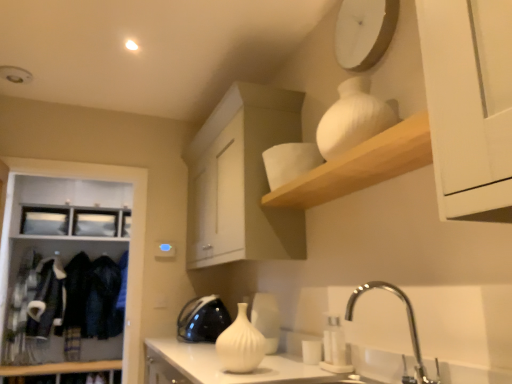
Question: From a real-world perspective, is white glossy vase at center physically below white matte clock at upper center?

Choices:
 (A) no
 (B) yes

Answer: (B)

Question: Can you confirm if white glossy vase at center is shorter than white matte clock at upper center?

Choices:
 (A) no
 (B) yes

Answer: (B)

Question: Could you tell me if white glossy vase at center is facing white matte clock at upper center?

Choices:
 (A) no
 (B) yes

Answer: (A)

Question: Is white glossy vase at center bigger than white matte clock at upper center?

Choices:
 (A) no
 (B) yes

Answer: (B)

Question: Does white glossy vase at center come behind white matte clock at upper center?

Choices:
 (A) no
 (B) yes

Answer: (A)

Question: Is white glossy vase at center positioned with its back to white matte clock at upper center?

Choices:
 (A) yes
 (B) no

Answer: (B)

Question: Is black glossy kettle at center, which is the 1th appliance in left-to-right order, with white glossy vase at center?

Choices:
 (A) yes
 (B) no

Answer: (B)

Question: Does black glossy kettle at center, which ranks as the first appliance in back-to-front order, have a lesser width compared to white glossy vase at center?

Choices:
 (A) no
 (B) yes

Answer: (B)

Question: Is white glossy vase at center inside black glossy kettle at center, acting as the 2th appliance starting from the front?

Choices:
 (A) yes
 (B) no

Answer: (B)

Question: Does black glossy kettle at center, the 2th appliance from the right, appear on the right side of white glossy vase at center?

Choices:
 (A) no
 (B) yes

Answer: (A)

Question: From the image's perspective, is black glossy kettle at center, which is the 1th appliance in left-to-right order, on top of white glossy vase at center?

Choices:
 (A) no
 (B) yes

Answer: (B)

Question: From a real-world perspective, is white glossy vase at center positioned under white matte vase at upper center based on gravity?

Choices:
 (A) yes
 (B) no

Answer: (A)